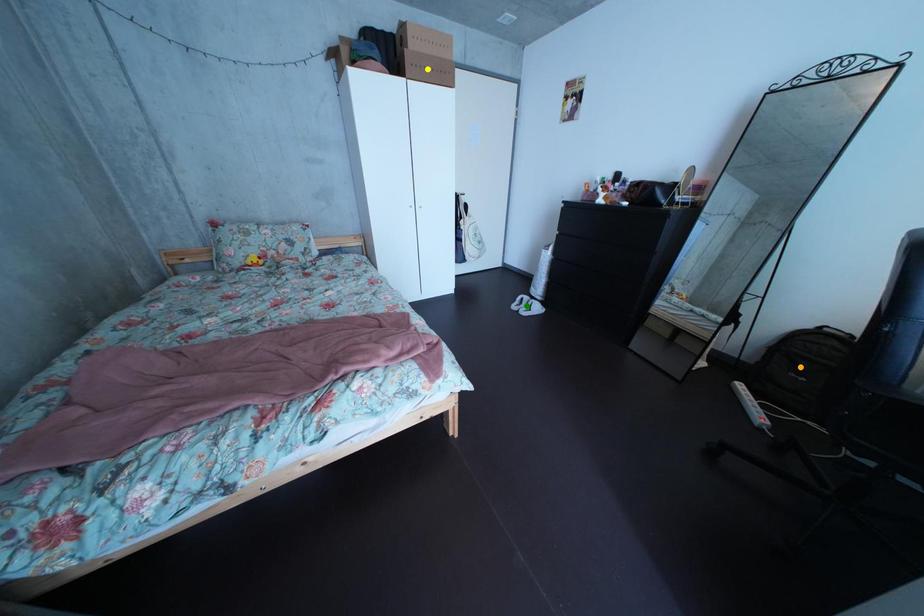
Order these from nearest to farthest:
A) yellow point
B) green point
C) orange point

green point, yellow point, orange point